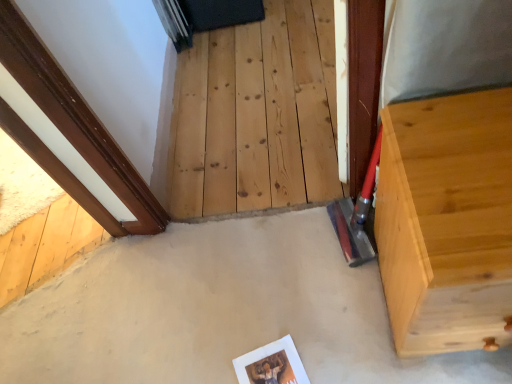
I want to click on vacant space that is to the left of light wood dresser at right, so click(x=327, y=311).